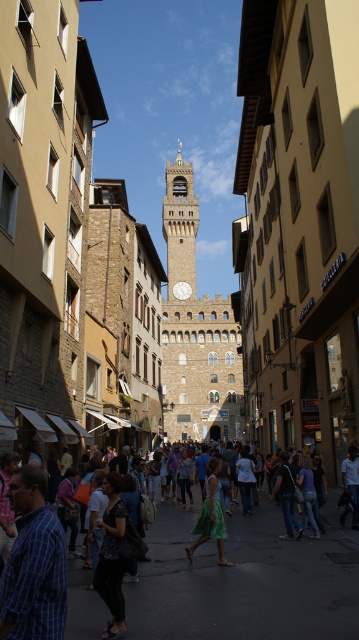
Question: Which object appears farthest from the camera in this image?

Choices:
 (A) stone clock tower at center
 (B) green dress at center
 (C) blue plaid shirt at lower left
 (D) green fabric skirt at center

Answer: (A)

Question: Is stone clock tower at center behind dark blue fabric dress at center?

Choices:
 (A) yes
 (B) no

Answer: (A)

Question: Can you confirm if stone clock tower at center is positioned below blue plaid shirt at lower left?

Choices:
 (A) yes
 (B) no

Answer: (B)

Question: Is green dress at center in front of green fabric skirt at center?

Choices:
 (A) yes
 (B) no

Answer: (A)

Question: Which is nearer to the green dress at center?

Choices:
 (A) dark blue fabric dress at center
 (B) blue plaid shirt at lower left
 (C) green fabric skirt at center

Answer: (C)

Question: Which of the following is the closest to the observer?

Choices:
 (A) green dress at center
 (B) dark blue fabric dress at center
 (C) blue plaid shirt at lower left

Answer: (C)